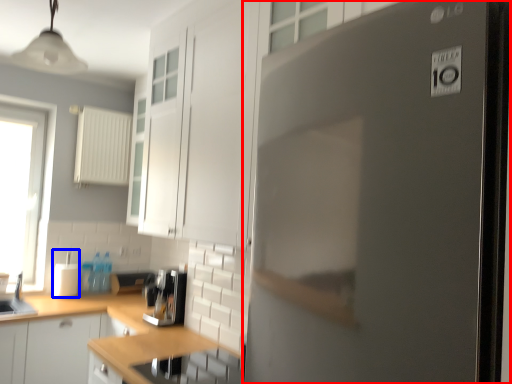
Question: Which object appears closest to the camera in this image, refrigerator (highlighted by a red box) or appliance (highlighted by a blue box)?

Choices:
 (A) refrigerator
 (B) appliance

Answer: (A)